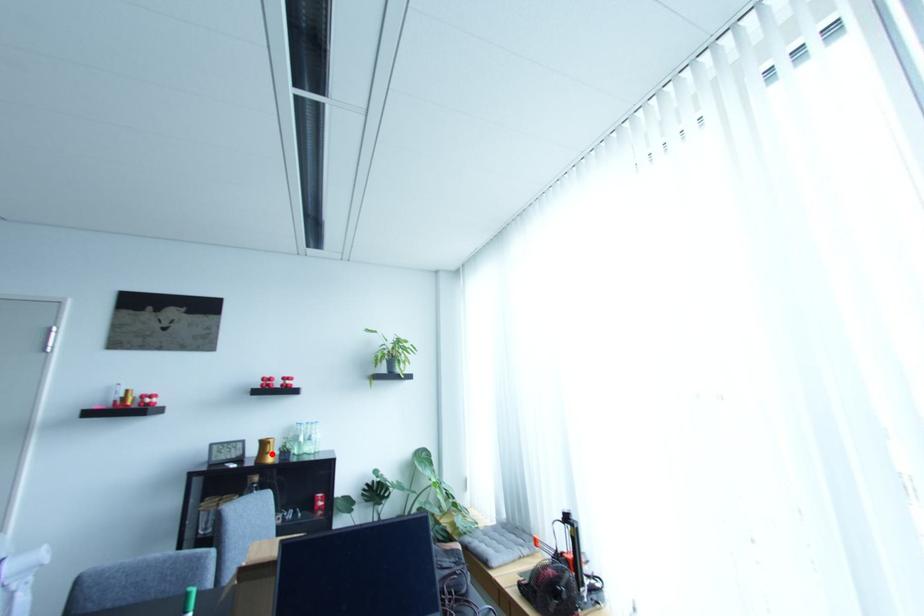
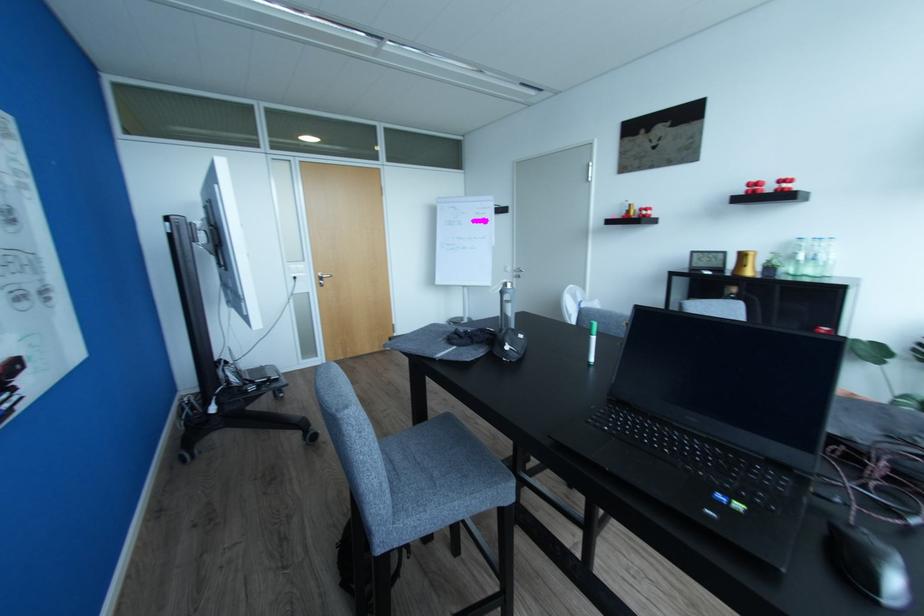
Question: I am providing you with two images of the same scene from different viewpoints. A red point is marked on the first image. Can you still see the location of the red point in image 2?

Choices:
 (A) Yes
 (B) No

Answer: (A)